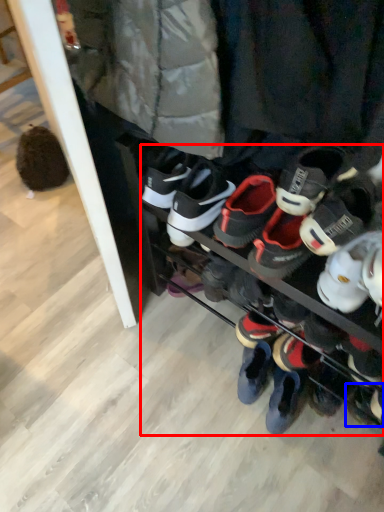
Question: Which of the following is the farthest to the observer, footwear (highlighted by a red box) or footwear (highlighted by a blue box)?

Choices:
 (A) footwear
 (B) footwear

Answer: (B)